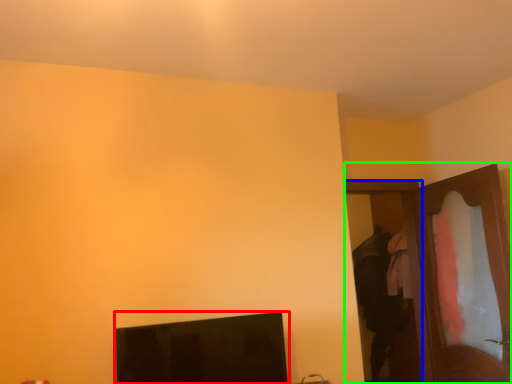
Question: Estimate the real-world distances between objects in this image. Which object is closer to computer monitor (highlighted by a red box), door (highlighted by a blue box) or dresser (highlighted by a green box)?

Choices:
 (A) door
 (B) dresser

Answer: (B)